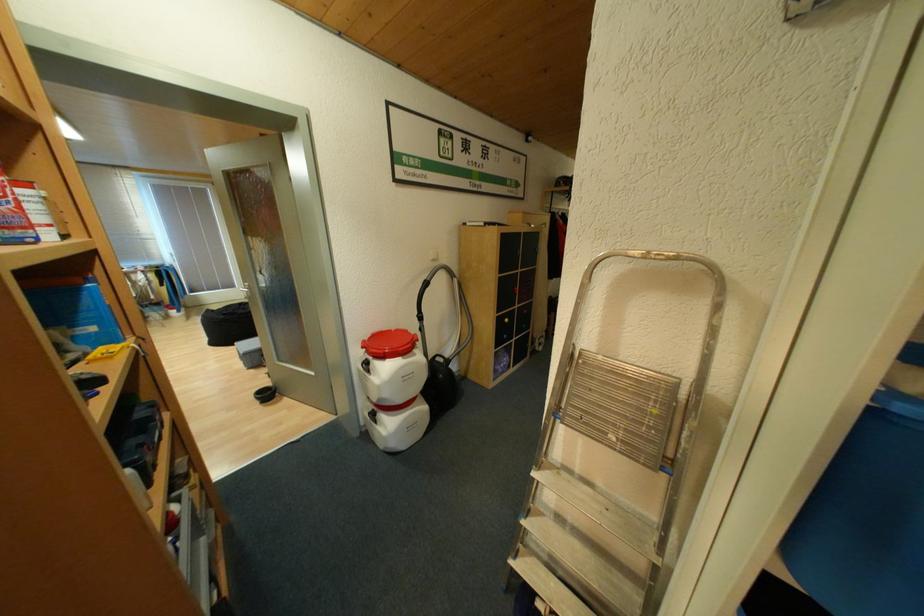
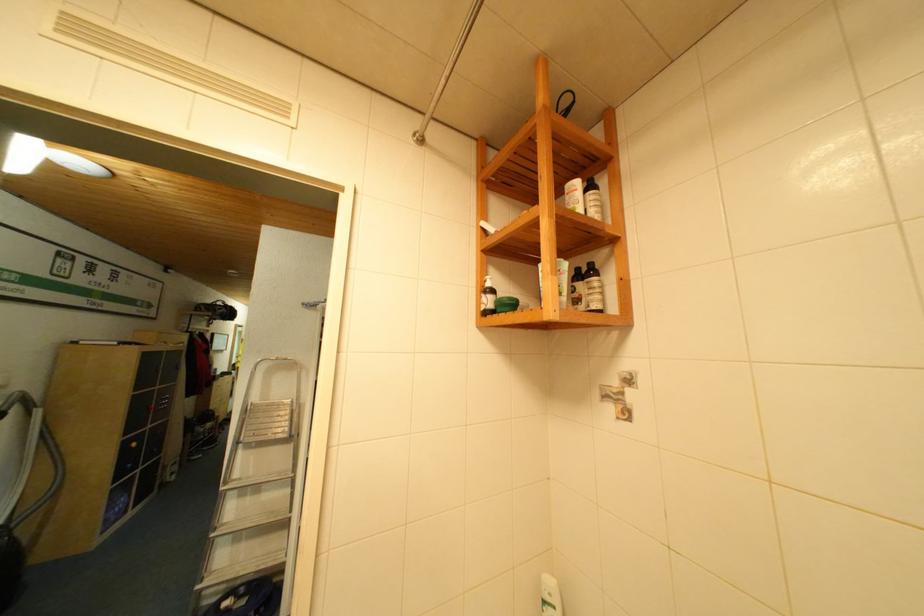
Locate, in the second image, the point that corresponds to the point at 597,342 in the first image.

(263, 400)